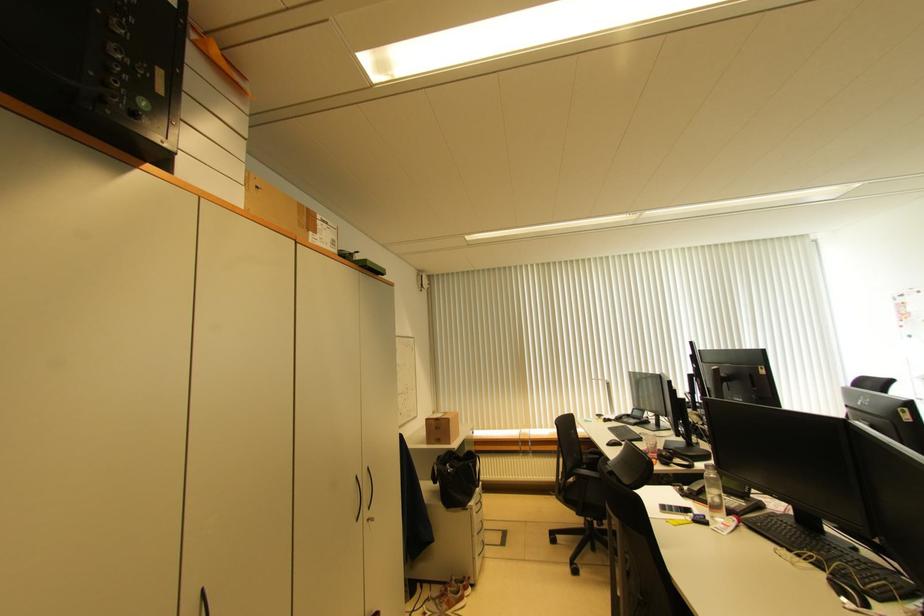
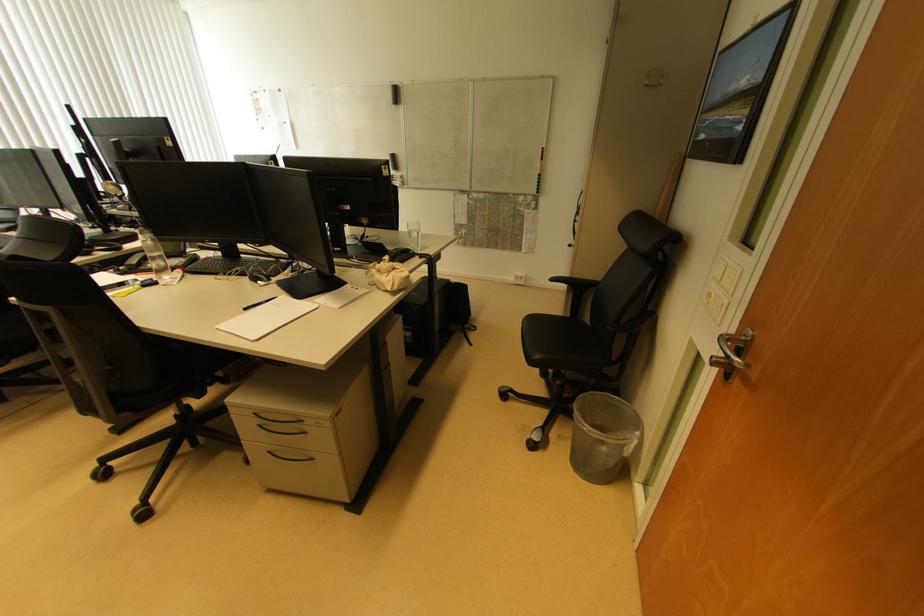
Find the pixel in the second image that matches point (824, 535) in the first image.

(242, 261)